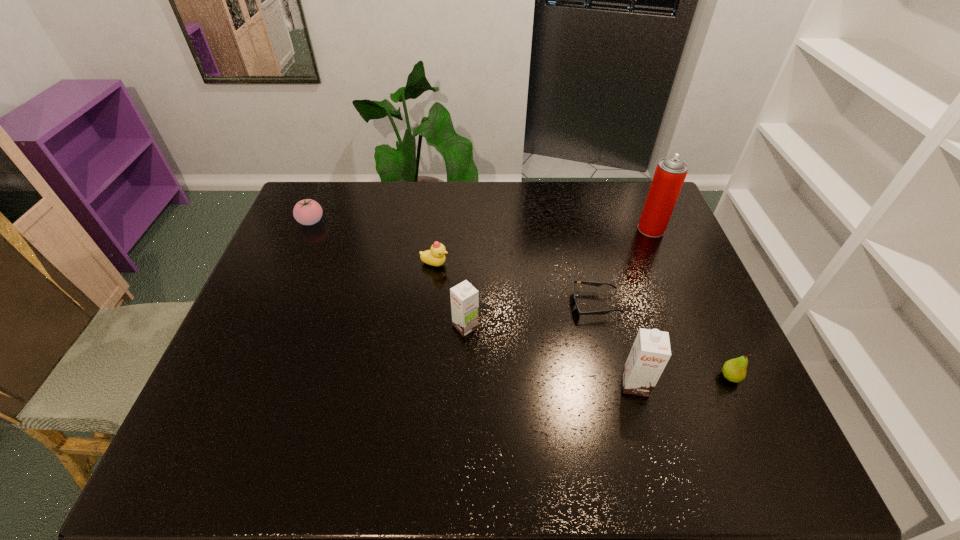
I want to click on free space at the near edge of the desktop, so click(540, 399).

Find the location of a particular element. This screenshot has height=540, width=960. vacant space at the left edge of the desktop is located at coordinates (265, 307).

This screenshot has width=960, height=540. Identify the location of vacant region at the far left corner of the desktop. (335, 201).

Where is `free spot between the third farthest object and the nearer chocolate milk`? free spot between the third farthest object and the nearer chocolate milk is located at coordinates (535, 324).

In order to click on free space between the tallest object and the leftmost object in this screenshot , I will do `click(481, 225)`.

At what (x,y) coordinates should I click in order to perform the action: click on free space between the third farthest object and the tallest object. Please return your answer as a coordinate pair (x, y). Image resolution: width=960 pixels, height=540 pixels. Looking at the image, I should click on (543, 247).

Identify the location of blank region between the pear and the second object from left to right. The height and width of the screenshot is (540, 960). (583, 320).

The image size is (960, 540). I want to click on vacant area between the sunglasses and the tomato, so click(453, 263).

Identify the location of empty space that is in between the tomato and the aerosol can. This screenshot has width=960, height=540. (481, 225).

The width and height of the screenshot is (960, 540). Find the location of `free point between the farther chocolate milk and the tomato`. free point between the farther chocolate milk and the tomato is located at coordinates (388, 274).